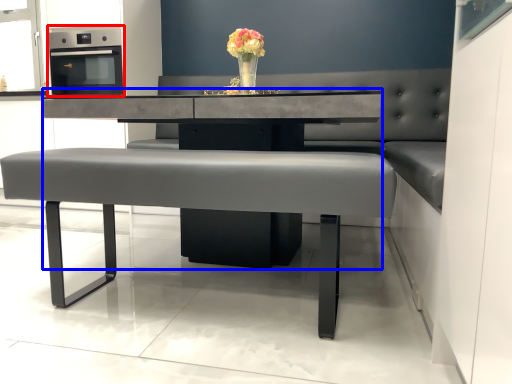
Question: Among these objects, which one is farthest to the camera, appliance (highlighted by a red box) or round table (highlighted by a blue box)?

Choices:
 (A) appliance
 (B) round table

Answer: (A)